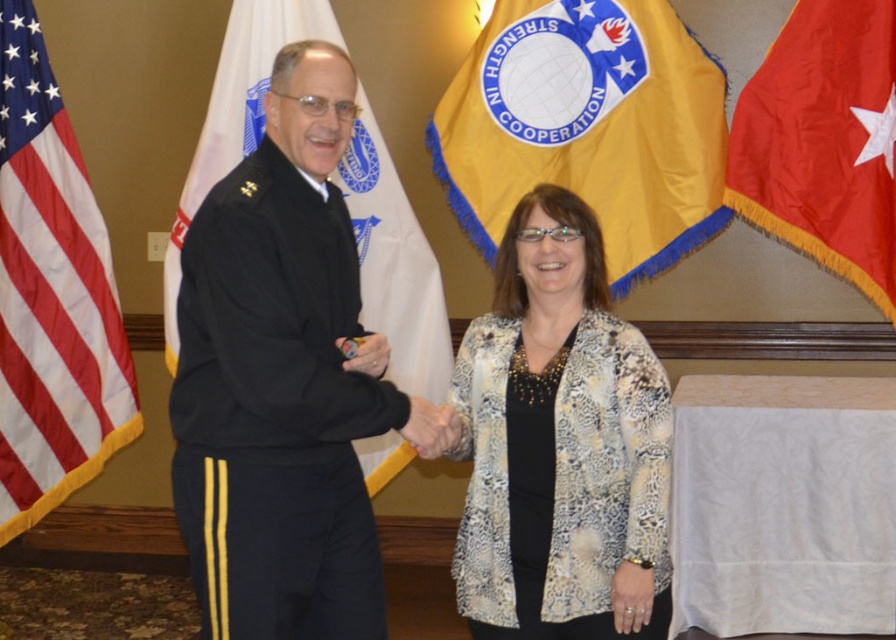
Can you confirm if black fabric uniform at center is taller than red fabric flag at right?

Incorrect, black fabric uniform at center's height is not larger of red fabric flag at right's.

Based on the photo, does black fabric uniform at center lie behind red fabric flag at right?

No, it is not.

Is point (200, 604) closer to camera compared to point (790, 186)?

Yes, point (200, 604) is in front of point (790, 186).

Identify the location of black fabric uniform at center. Image resolution: width=896 pixels, height=640 pixels. (274, 412).

Which is above, red fabric flag at right or black fabric flag at left?

red fabric flag at right

Is red fabric flag at right shorter than black fabric flag at left?

Yes.

Who is more forward, (868, 275) or (382, 248)?

Point (868, 275)

You are a GUI agent. You are given a task and a screenshot of the screen. Output one action in this format:
    pyautogui.click(x=<x>, y=<y>)
    Task: Click on the red fabric flag at right
    
    Given the screenshot: What is the action you would take?
    pyautogui.click(x=823, y=141)

Is point (656, 221) closer to camera compared to point (764, 188)?

That is False.

Consider the image. Who is more distant from viewer, (636, 70) or (828, 19)?

Point (636, 70)

Between point (487, 257) and point (872, 292), which one is positioned in front?

Point (872, 292)

Where is `yellow fabric flag at center`? Image resolution: width=896 pixels, height=640 pixels. yellow fabric flag at center is located at coordinates [x=588, y=125].